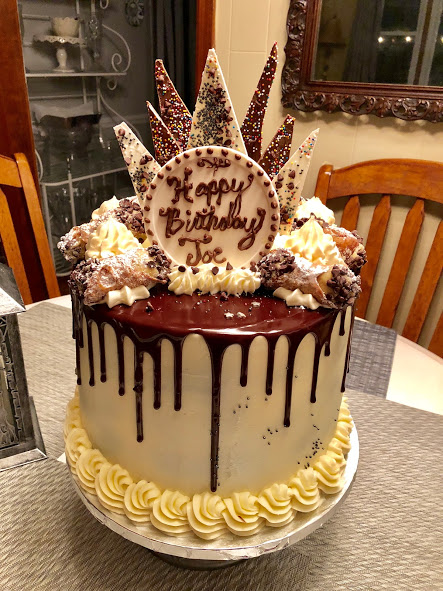
At what (x,y) coordinates should I click in order to perform the action: click on round silver foiled cake base. Please return your answer as a coordinate pair (x, y). Looking at the image, I should click on (x=224, y=548).